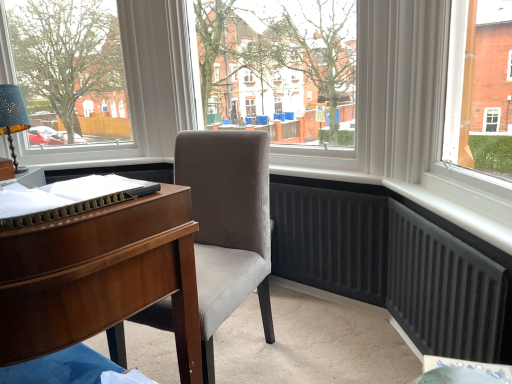
Question: Is transparent glass window at center to the right of matte white frame at upper left from the viewer's perspective?

Choices:
 (A) no
 (B) yes

Answer: (B)

Question: From the image's perspective, is transparent glass window at center beneath matte white frame at upper left?

Choices:
 (A) yes
 (B) no

Answer: (A)

Question: From the image's perspective, is transparent glass window at center on matte white frame at upper left?

Choices:
 (A) yes
 (B) no

Answer: (B)

Question: Is transparent glass window at center outside of matte white frame at upper left?

Choices:
 (A) yes
 (B) no

Answer: (A)

Question: Are transparent glass window at center and matte white frame at upper left making contact?

Choices:
 (A) no
 (B) yes

Answer: (A)

Question: Considering the positions of point (11, 84) and point (244, 6), is point (11, 84) closer or farther from the camera than point (244, 6)?

Choices:
 (A) closer
 (B) farther

Answer: (B)

Question: In terms of height, does matte blue lampshade at left look taller or shorter compared to transparent glass window at center?

Choices:
 (A) short
 (B) tall

Answer: (A)

Question: Is matte blue lampshade at left bigger or smaller than transparent glass window at center?

Choices:
 (A) big
 (B) small

Answer: (B)

Question: In terms of width, does matte blue lampshade at left look wider or thinner when compared to transparent glass window at center?

Choices:
 (A) thin
 (B) wide

Answer: (A)

Question: Would you say transparent glass window at center is to the left or to the right of matte white frame at upper left in the picture?

Choices:
 (A) left
 (B) right

Answer: (B)

Question: Is transparent glass window at center situated inside matte white frame at upper left or outside?

Choices:
 (A) outside
 (B) inside

Answer: (A)

Question: From a real-world perspective, is transparent glass window at center physically located above or below matte white frame at upper left?

Choices:
 (A) above
 (B) below

Answer: (B)

Question: From the image's perspective, is transparent glass window at center positioned above or below matte white frame at upper left?

Choices:
 (A) above
 (B) below

Answer: (B)

Question: Is point (264, 192) closer or farther from the camera than point (265, 24)?

Choices:
 (A) farther
 (B) closer

Answer: (B)

Question: Which is correct: velvet grey chair at center is inside transparent glass window at center, or outside of it?

Choices:
 (A) inside
 (B) outside

Answer: (B)